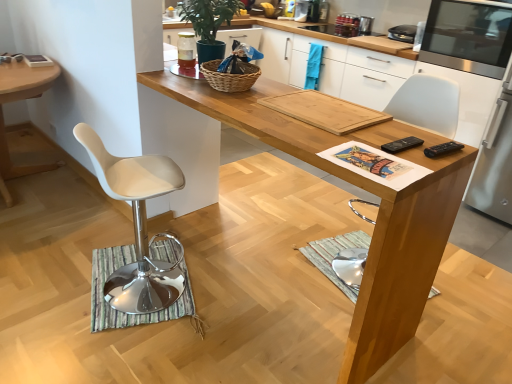
The height and width of the screenshot is (384, 512). Find the location of `vacant space in front of wooden cutting board at center`. vacant space in front of wooden cutting board at center is located at coordinates (349, 140).